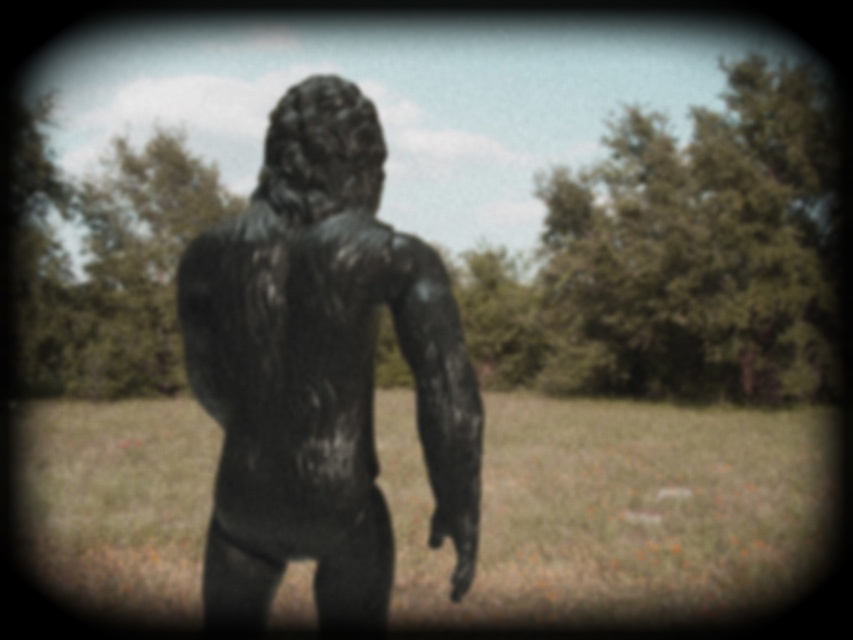
You are standing at the point marked as point (x=616, y=508) in the image. What is the object directly beneath your feet?

The object directly beneath your feet at point (x=616, y=508) is green grass at center.

You are a photographer trying to capture the black matte statue at center without any green grass at center in the foreground. Based on the scene description, is this possible? Explain why or why not.

The black matte statue at center is behind the green grass at center, so it is possible to position the camera so that the green grass at center is not in the foreground of the statue. By moving the camera angle or adjusting the focus, the photographer can frame the shot to exclude the green grass at center from blocking the statue.

You are a photographer wanting to capture the black matte statue at center without any background distractions. Since the statue is at the center, where should you focus your camera to ensure the green grass at center is not in the foreground?

To avoid the green grass at center appearing in the foreground, focus your camera on the black matte statue at center since the green grass at center is positioned under it.